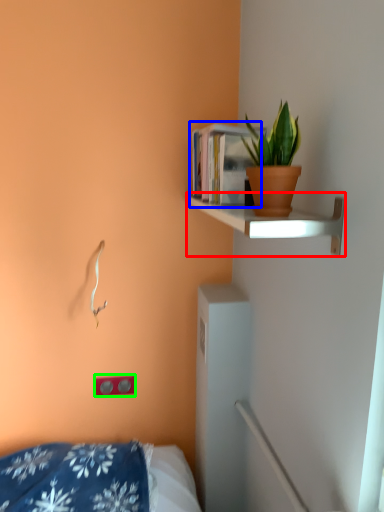
Question: Which is nearer to the shelf (highlighted by a red box)? book (highlighted by a blue box) or electric outlet (highlighted by a green box).

Choices:
 (A) book
 (B) electric outlet

Answer: (A)